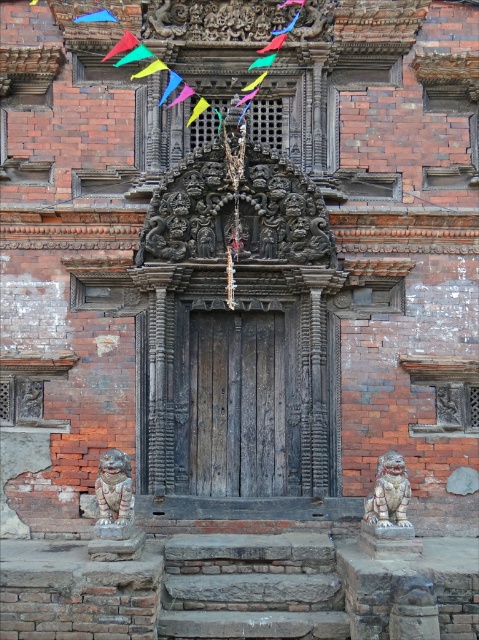
Is polished silver lion at lower left behind blue fabric flag at upper left?

No, it is not.

The image size is (479, 640). I want to click on polished silver lion at lower left, so click(114, 496).

Can you confirm if weathered wood door at center is wider than polished silver lion at lower left?

Indeed, weathered wood door at center has a greater width compared to polished silver lion at lower left.

Is weathered wood door at center thinner than polished silver lion at lower left?

In fact, weathered wood door at center might be wider than polished silver lion at lower left.

Between point (232, 394) and point (115, 534), which one is positioned behind?

The point (232, 394) is behind.

Locate an element on the screen. Image resolution: width=479 pixels, height=640 pixels. weathered wood door at center is located at coordinates (242, 403).

Between polished silver lion at lower left and white stone lion at lower right, which one is positioned lower?

polished silver lion at lower left is lower down.

Consider the image. Who is more distant from viewer, (118, 483) or (371, 492)?

The point (371, 492) is more distant.

The height and width of the screenshot is (640, 479). Identify the location of polished silver lion at lower left. (114, 496).